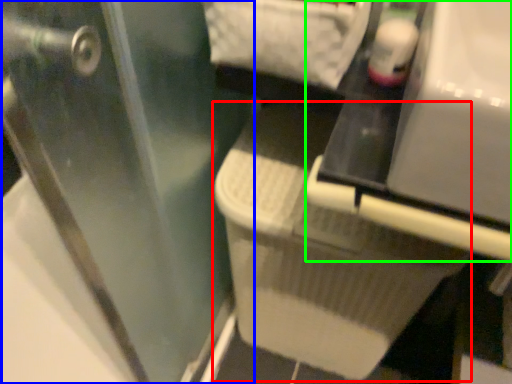
Question: Estimate the real-world distances between objects in this image. Which object is closer to laundry basket (highlighted by a red box), screen door (highlighted by a blue box) or vanity (highlighted by a green box)?

Choices:
 (A) screen door
 (B) vanity

Answer: (A)